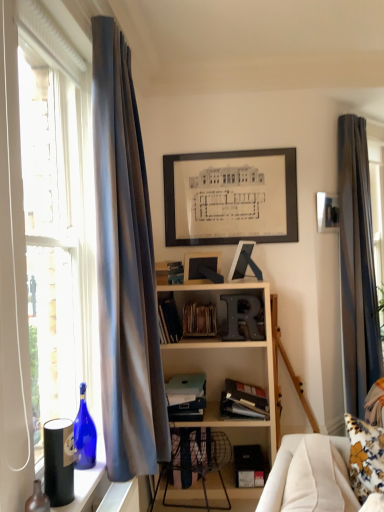
Question: Is matte blue book at center, the 1th book from the top, inside or outside of hardcover book at center, the 2th book from the bottom?

Choices:
 (A) inside
 (B) outside

Answer: (B)

Question: Considering the relative positions of matte blue book at center, the 5th book ordered from the bottom, and hardcover book at center, the 2th book from the bottom, in the image provided, is matte blue book at center, the 5th book ordered from the bottom, to the left or to the right of hardcover book at center, the 2th book from the bottom,?

Choices:
 (A) right
 (B) left

Answer: (B)

Question: Which of these objects is positioned farthest from the matte glass bottle at lower left, which appears as the 2th bottle when viewed from the back?

Choices:
 (A) silky blue curtain at right, acting as the 1th curtain starting from the right
 (B) hardcover book at center, acting as the fourth book starting from the top
 (C) matte black picture frame at upper center, the 2th picture frame when ordered from back to front
 (D) matte blue book at center, the 5th book ordered from the bottom
 (E) matte black picture frame at center, the third picture frame positioned from the top

Answer: (A)

Question: Estimate the real-world distances between objects in this image. Which object is farther from the hardcover book at center, acting as the fourth book starting from the top?

Choices:
 (A) matte black book at center, marked as the 1th book in a bottom-to-top arrangement
 (B) matte blue book at center, the 1th book from the top
 (C) satin blue curtain at left, the 1th curtain when ordered from left to right
 (D) hardcover book at center, which is counted as the 3th book, starting from the top
 (E) blue glass bottle at window, which is counted as the 2th bottle, starting from the front

Answer: (C)